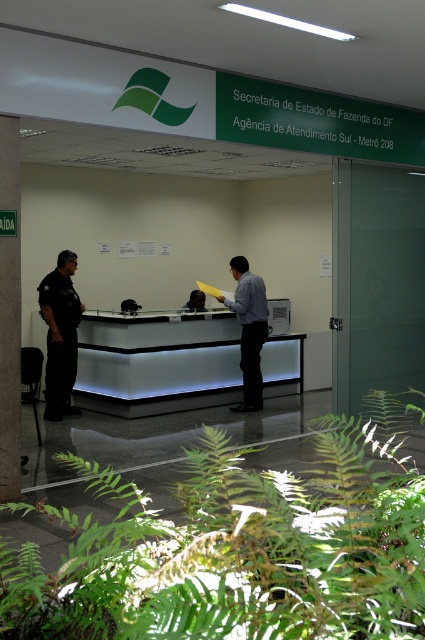
Between point (73, 352) and point (192, 305), which one is positioned behind?

The point (192, 305) is behind.

Locate an element on the screen. black uniform at left is located at coordinates click(x=59, y=336).

Between light blue shirt at center and matte black laptop at center, which one is positioned lower?

Positioned lower is light blue shirt at center.

Find the location of a particular element. The height and width of the screenshot is (640, 425). light blue shirt at center is located at coordinates (249, 330).

Is white glossy information desk at center smaller than light blue shirt at center?

No.

Based on the photo, can you confirm if white glossy information desk at center is positioned below light blue shirt at center?

Correct, white glossy information desk at center is located below light blue shirt at center.

Between point (288, 356) and point (255, 356), which one is positioned in front?

Point (255, 356) is in front.

At what (x,y) coordinates should I click in order to perform the action: click on white glossy information desk at center. Please return your answer as a coordinate pair (x, y). The height and width of the screenshot is (640, 425). Looking at the image, I should click on (156, 364).